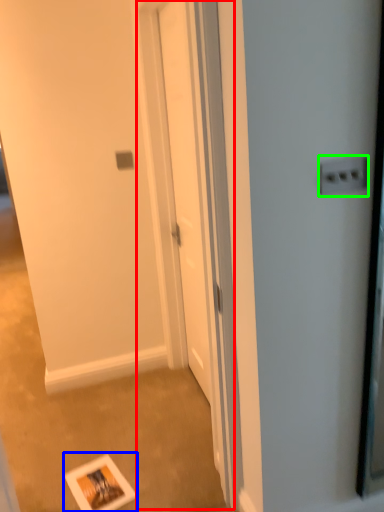
Question: Which object is the farthest from screen door (highlighted by a red box)? Choose among these: postcard (highlighted by a blue box) or electric outlet (highlighted by a green box).

Choices:
 (A) postcard
 (B) electric outlet

Answer: (B)